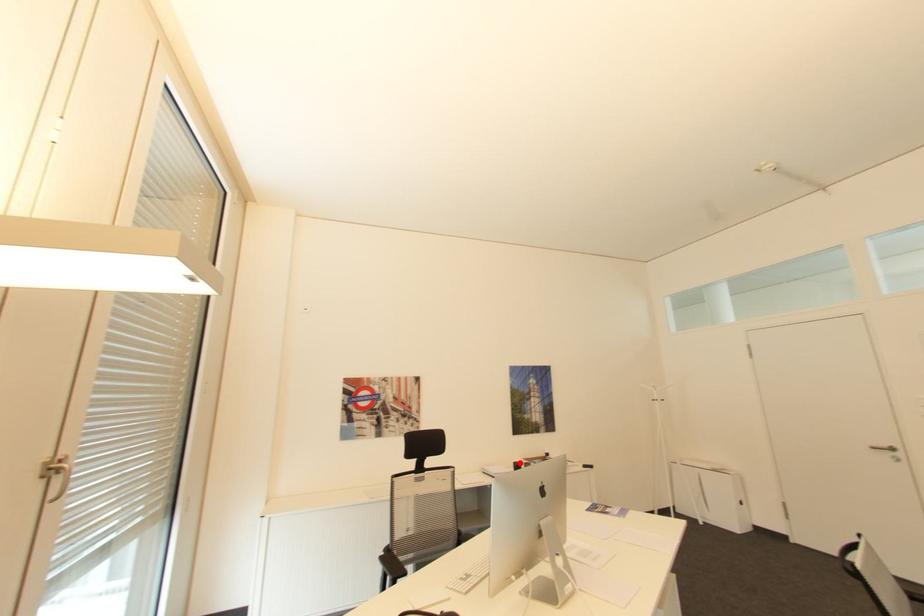
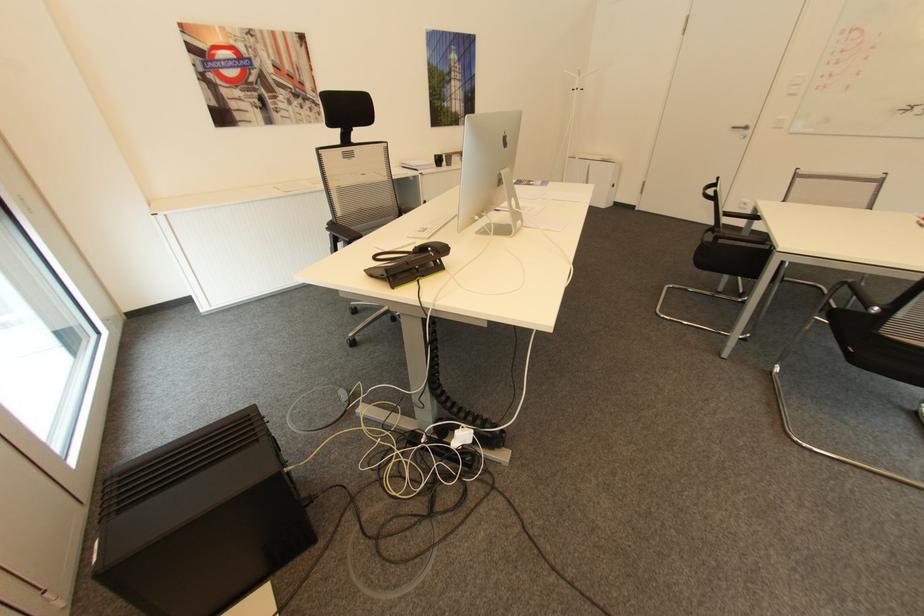
Question: I am providing you with two images of the same scene from different viewpoints. Given a red point in image1, look at the same physical point in image2. Is it:

Choices:
 (A) Closer to the viewpoint
 (B) Farther from the viewpoint

Answer: (A)